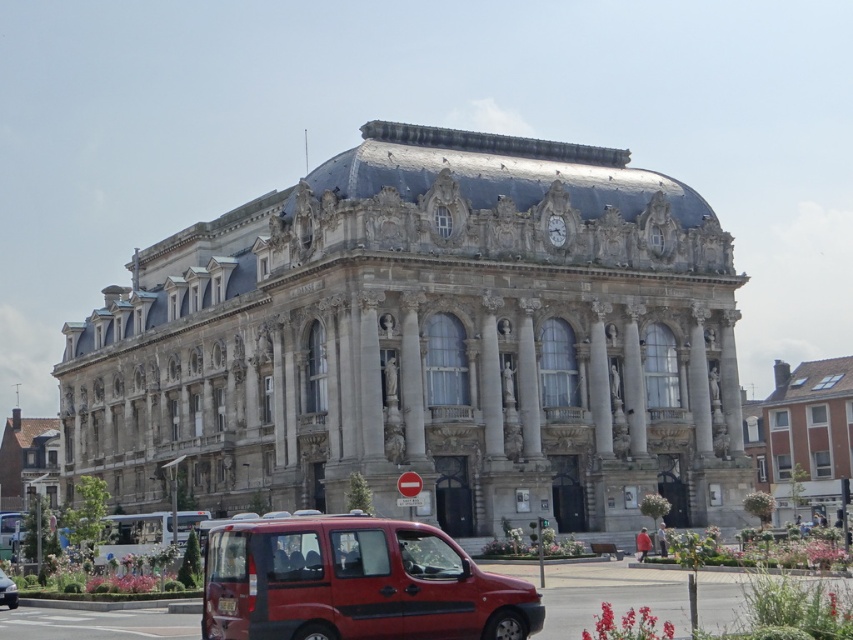
You are an architect analyzing the image of two buildings. The stone building at center and the brick building at left are part of a cityscape. Based on the scene, which building appears taller?

The stone building at center appears taller than the brick building at left as it has a greater height compared to it.

You are a city planner reviewing a historical district map. The map shows the stone building at center and the brick building at left. Based on their positions, which building is closer to the main entrance of the district?

The stone building at center is closer to the main entrance because it is positioned over the brick building at left, indicating it is in front and thus nearer to the entrance.

You are standing in front of the grand, ornate building with classical architectural features. You notice a stone building at center and a brick building at left. Which building is closer to you?

The stone building at center is closer to you because it is in front of the brick building at left.